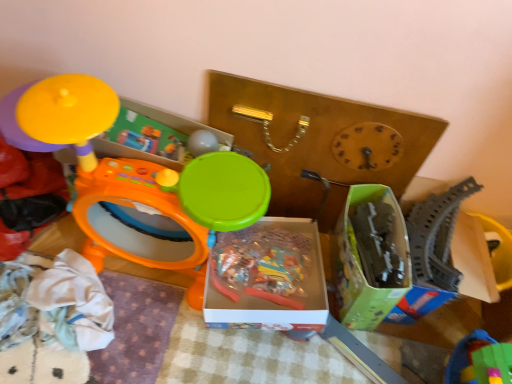
Question: Would you say matte yellow toy at upper left, placed as the 1th toy when sorted from left to right, is part of green plastic blocks at lower right, which is counted as the 2th toy, starting from the right,'s contents?

Choices:
 (A) no
 (B) yes

Answer: (A)

Question: Does green plastic blocks at lower right, which is counted as the 2th toy, starting from the right, have a greater height compared to matte yellow toy at upper left, which is the fourth toy in right-to-left order?

Choices:
 (A) no
 (B) yes

Answer: (A)

Question: Can you confirm if green plastic blocks at lower right, which is counted as the 2th toy, starting from the right, is positioned to the left of matte yellow toy at upper left, which is the fourth toy in right-to-left order?

Choices:
 (A) yes
 (B) no

Answer: (B)

Question: From a real-world perspective, is green plastic blocks at lower right, the 3th toy viewed from the left, physically above matte yellow toy at upper left, placed as the 1th toy when sorted from left to right?

Choices:
 (A) no
 (B) yes

Answer: (A)

Question: From the image's perspective, does green plastic blocks at lower right, which is counted as the 2th toy, starting from the right, appear lower than matte yellow toy at upper left, which is the fourth toy in right-to-left order?

Choices:
 (A) yes
 (B) no

Answer: (A)

Question: Is green plastic blocks at lower right, the 3th toy viewed from the left, next to matte yellow toy at upper left, placed as the 1th toy when sorted from left to right, and touching it?

Choices:
 (A) no
 (B) yes

Answer: (A)

Question: Does translucent plastic box at center, the 2th storage box in the right-to-left sequence, have a lesser height compared to gray plastic train track at right, which is the 4th toy in left-to-right order?

Choices:
 (A) yes
 (B) no

Answer: (A)

Question: From a real-world perspective, is translucent plastic box at center, the 2th storage box in the right-to-left sequence, located beneath gray plastic train track at right, positioned as the first toy in right-to-left order?

Choices:
 (A) yes
 (B) no

Answer: (A)

Question: Does translucent plastic box at center, which is the first storage box in left-to-right order, lie in front of gray plastic train track at right, positioned as the first toy in right-to-left order?

Choices:
 (A) no
 (B) yes

Answer: (B)

Question: Is translucent plastic box at center, the 2th storage box in the right-to-left sequence, further to camera compared to gray plastic train track at right, positioned as the first toy in right-to-left order?

Choices:
 (A) no
 (B) yes

Answer: (A)

Question: From the image's perspective, is translucent plastic box at center, which is the first storage box in left-to-right order, over gray plastic train track at right, positioned as the first toy in right-to-left order?

Choices:
 (A) yes
 (B) no

Answer: (B)

Question: Is translucent plastic box at center, the 2th storage box in the right-to-left sequence, thinner than gray plastic train track at right, positioned as the first toy in right-to-left order?

Choices:
 (A) yes
 (B) no

Answer: (B)

Question: From the image's perspective, is gray plastic train track at right, positioned as the first toy in right-to-left order, above orange plastic drum at left, positioned as the 2th toy in left-to-right order?

Choices:
 (A) no
 (B) yes

Answer: (A)